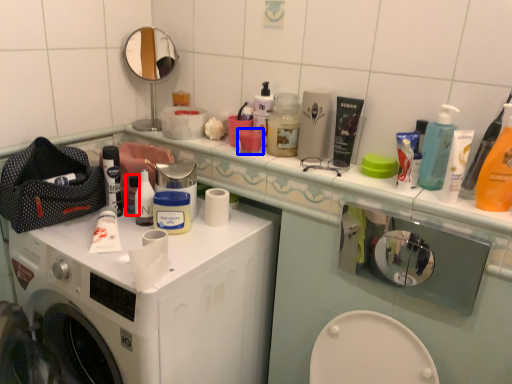
Question: Which object is closer to the camera taking this photo, toiletry (highlighted by a red box) or mouthwash (highlighted by a blue box)?

Choices:
 (A) toiletry
 (B) mouthwash

Answer: (B)